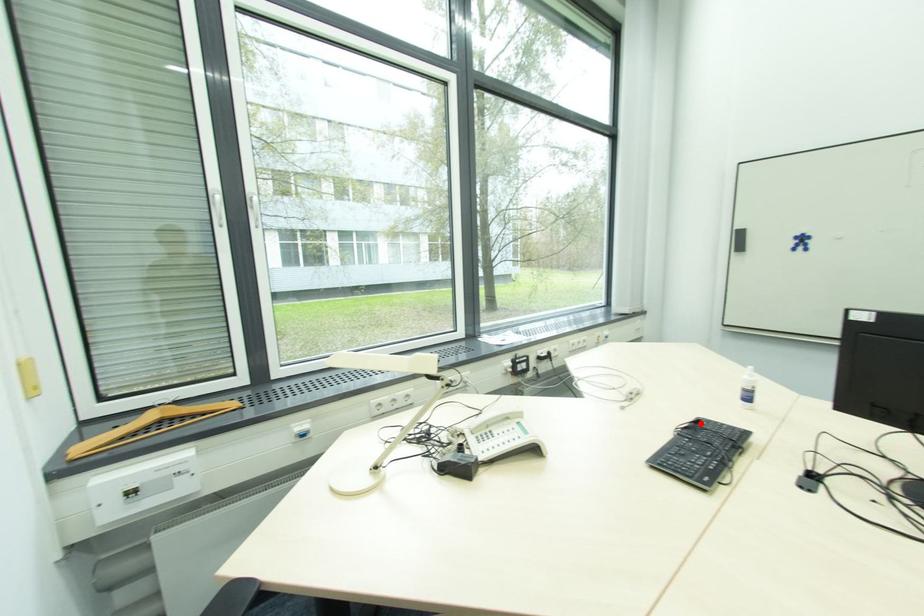
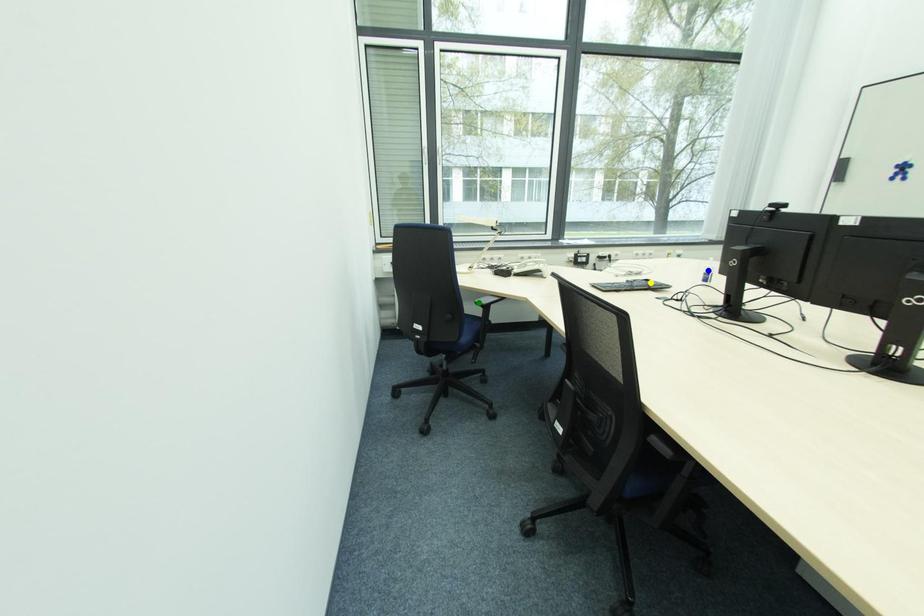
Question: I am providing you with two images of the same scene from different viewpoints. A red point is marked on the first image. You are given multiple points on the second image. Can you choose the point in image 2 that corresponds to the point in image 1?

Choices:
 (A) blue point
 (B) yellow point
 (C) green point

Answer: (B)